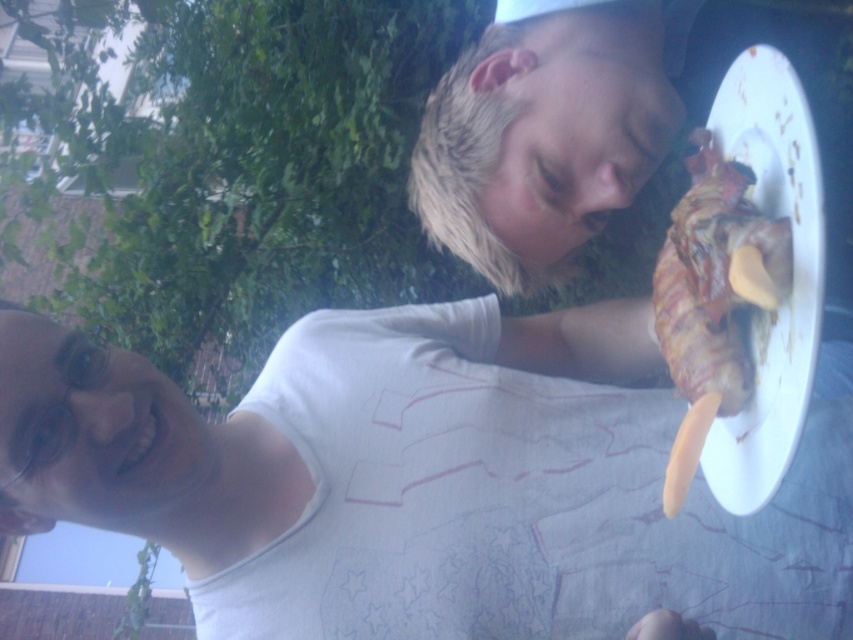
Between white matte plate at upper right and grilled meat with cheese at right, which one is positioned lower?

grilled meat with cheese at right is below.

Can you confirm if white matte plate at upper right is positioned above grilled meat with cheese at right?

Correct, white matte plate at upper right is located above grilled meat with cheese at right.

Is point (805, 349) farther from viewer compared to point (688, 294)?

No, it is not.

The width and height of the screenshot is (853, 640). I want to click on white matte plate at upper right, so click(x=793, y=275).

Who is positioned more to the left, white matte shirt at center or grilled meat with cheese at right?

white matte shirt at center

Is white matte shirt at center in front of grilled meat with cheese at right?

No.

Does point (248, 444) come behind point (766, 240)?

Yes, point (248, 444) is behind point (766, 240).

You are a GUI agent. You are given a task and a screenshot of the screen. Output one action in this format:
    pyautogui.click(x=<x>, y=<y>)
    Task: Click on the white matte shirt at center
    
    Given the screenshot: What is the action you would take?
    pyautogui.click(x=135, y=452)

Does white matte shirt at center come behind white matte plate at upper right?

Yes, it is behind white matte plate at upper right.

Does white matte shirt at center appear over white matte plate at upper right?

Actually, white matte shirt at center is below white matte plate at upper right.

Measure the distance between white matte shirt at center and camera.

31.04 inches

Where is `white matte shirt at center`? This screenshot has width=853, height=640. white matte shirt at center is located at coordinates (135, 452).